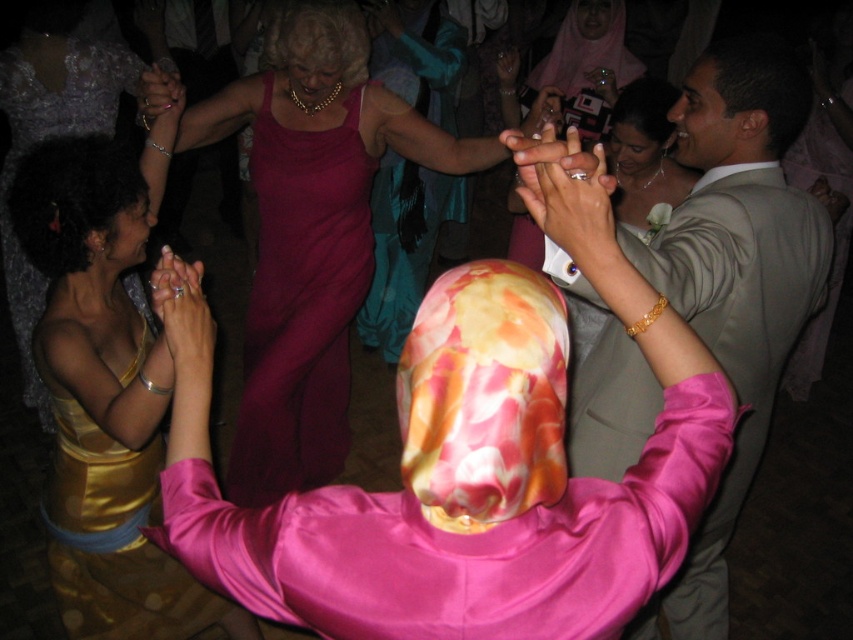
You are at the lively social gathering described. There is a point marked at coordinates [735,276]. What object is located at this point?

The point at coordinates [735,276] corresponds to the matte beige suit at center.

You are a photographer at a wedding reception. You need to capture a photo of the satin pink robe at center and the matte beige suit at center. Based on their positions, which one should you focus on first to ensure both are in the frame?

The satin pink robe at center is positioned on the left side of matte beige suit at center, so you should focus on the matte beige suit at center first to ensure both are in the frame.

Looking at this image, you are at the wedding reception and want to take a photo of both the pink outfit dancer and the gold dress participant. The photographer tells you that the camera can only focus on objects within a certain depth range. Given that point 1 at [720,493] corresponds to the pink outfit dancer and point 2 at [128,58] corresponds to the gold dress participant, will both subjects be in focus if the camera is focused on the dancer?

Yes, because point 1 at [720,493] is in front of point 2 at [128,58], meaning the dancer is closer to the camera. When focused on the dancer, the depth of field may still include the gold dress participant if they are within the acceptable focus range. However, the exact focus depends on camera settings like aperture and distance between subjects.